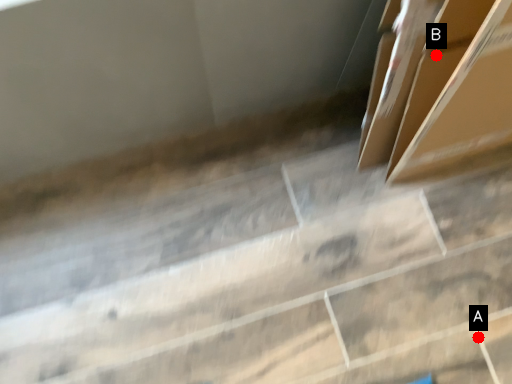
Question: Two points are circled on the image, labeled by A and B beside each circle. Which point is further to the camera?

Choices:
 (A) A is further
 (B) B is further

Answer: (A)